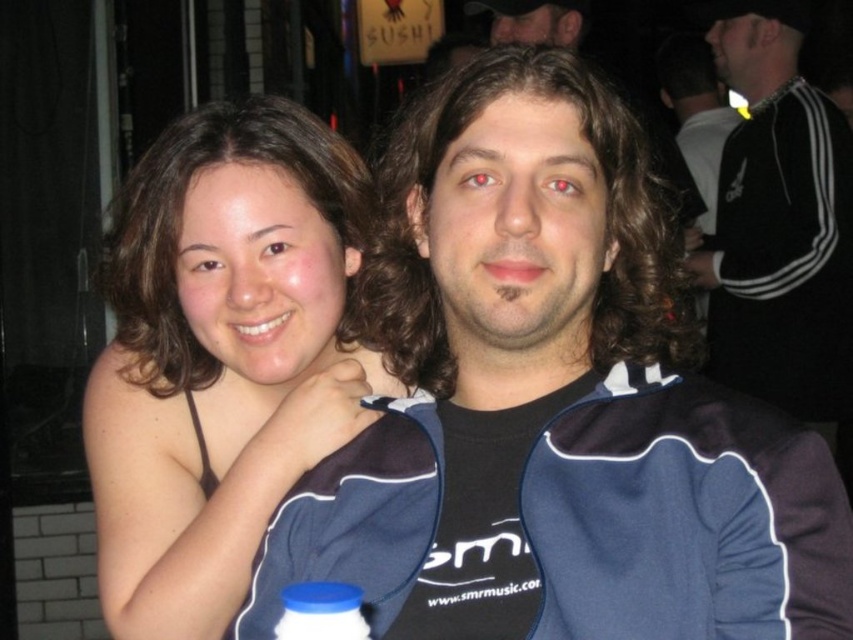
Question: Can you confirm if black adidas tracksuit at right is positioned below blue plastic bottle at lower center?

Choices:
 (A) yes
 (B) no

Answer: (B)

Question: Which object is closer to the camera taking this photo?

Choices:
 (A) blue plastic bottle at lower center
 (B) black adidas tracksuit at right
 (C) brown hair at upper left
 (D) matte black hair at upper center

Answer: (A)

Question: Which point is farther to the camera?

Choices:
 (A) matte black hair at upper center
 (B) blue plastic bottle at lower center

Answer: (A)

Question: Where is brown hair at upper left located in relation to matte black hair at upper center in the image?

Choices:
 (A) below
 (B) above

Answer: (A)

Question: Is brown hair at upper left positioned before black adidas tracksuit at right?

Choices:
 (A) yes
 (B) no

Answer: (A)

Question: Based on their relative distances, which object is nearer to the blue plastic bottle at lower center?

Choices:
 (A) matte black hair at upper center
 (B) brown hair at upper left

Answer: (B)